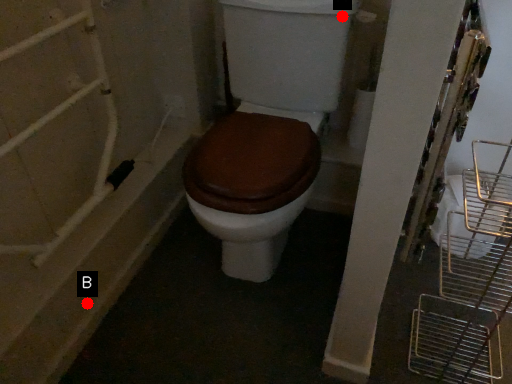
Question: Two points are circled on the image, labeled by A and B beside each circle. Which point is farther to the camera?

Choices:
 (A) A is further
 (B) B is further

Answer: (A)